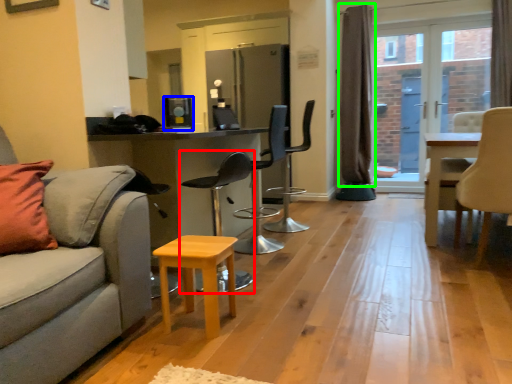
Question: Which object is the closest to the chair (highlighted by a red box)? Choose among these: appliance (highlighted by a blue box) or curtain (highlighted by a green box).

Choices:
 (A) appliance
 (B) curtain

Answer: (A)